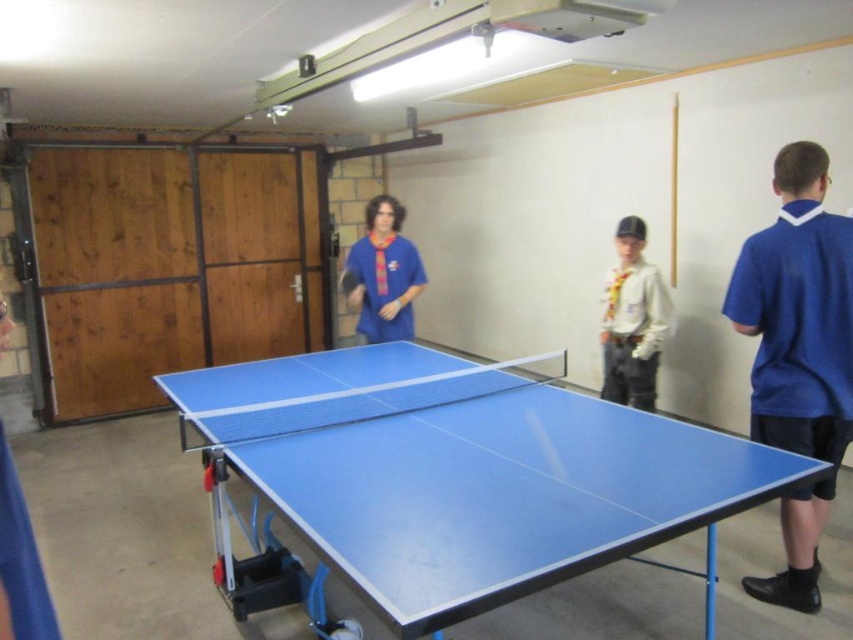
Looking at this image, you are organizing a ping pong tournament and need to ensure that the blue rubber table at center can accommodate all participants. Considering the size of the blue fabric shirt at right, is the table large enough?

The blue rubber table at center is bigger than the blue fabric shirt at right, so yes, the table is large enough to accommodate all participants as it is larger in size compared to the shirt.

You are a photographer setting up a shoot in the garage. You need to place a light source to the left of the blue rubber table at center. Where should you position the light relative to the matte blue shirt at center?

The blue rubber table at center is on the right side of the matte blue shirt at center. To place the light to the left of the blue rubber table at center, position it to the left side of the matte blue shirt at center.